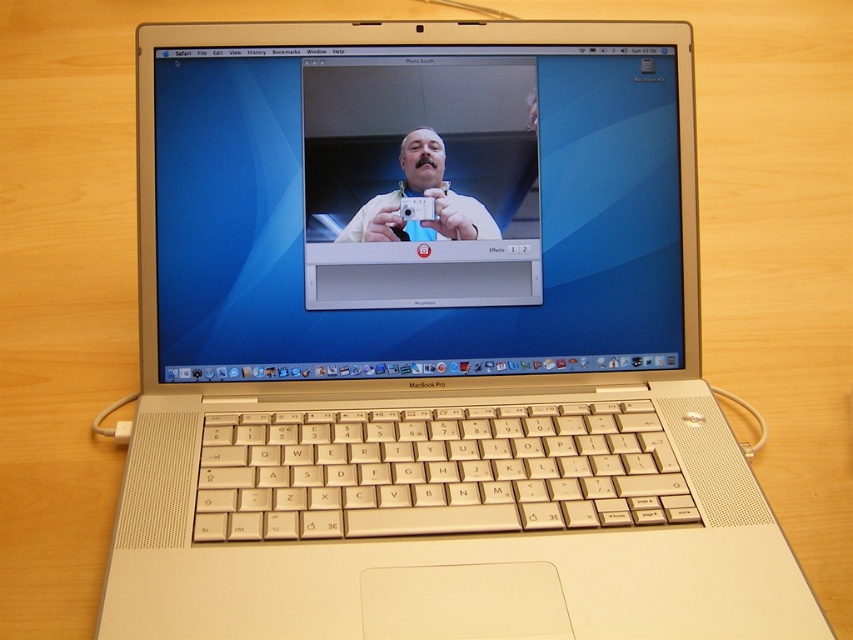
Who is more distant from viewer, (390, 54) or (436, 156)?

Point (390, 54)

Does point (660, 115) come farther from viewer compared to point (370, 216)?

Yes.

This screenshot has height=640, width=853. I want to click on satin gold laptop at center, so click(415, 221).